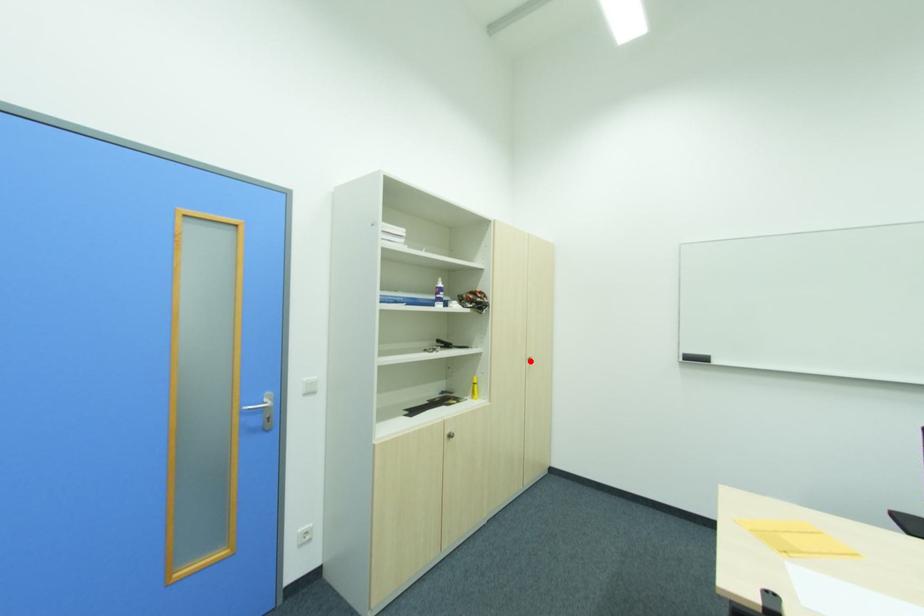
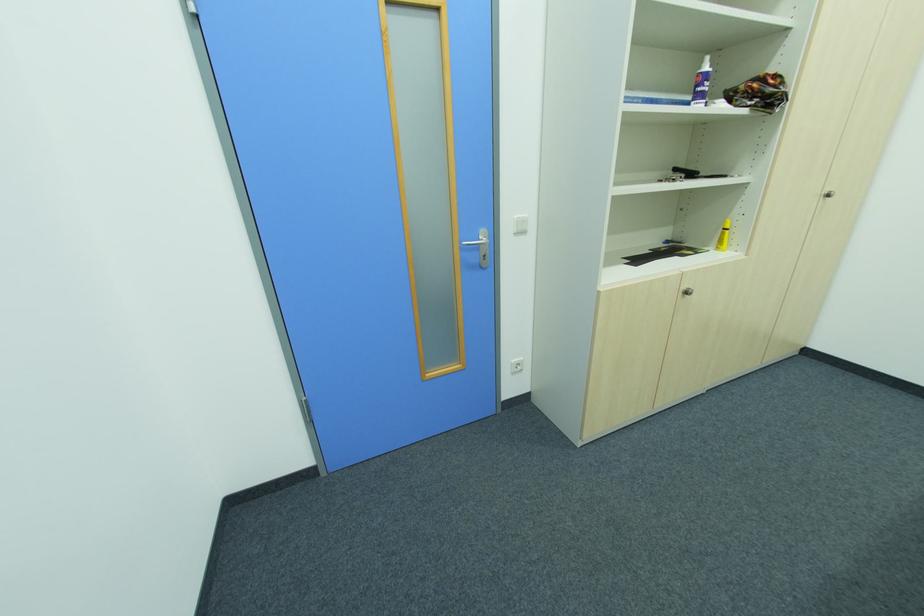
The point at the highlighted location is marked in the first image. Where is the corresponding point in the second image?

(822, 198)